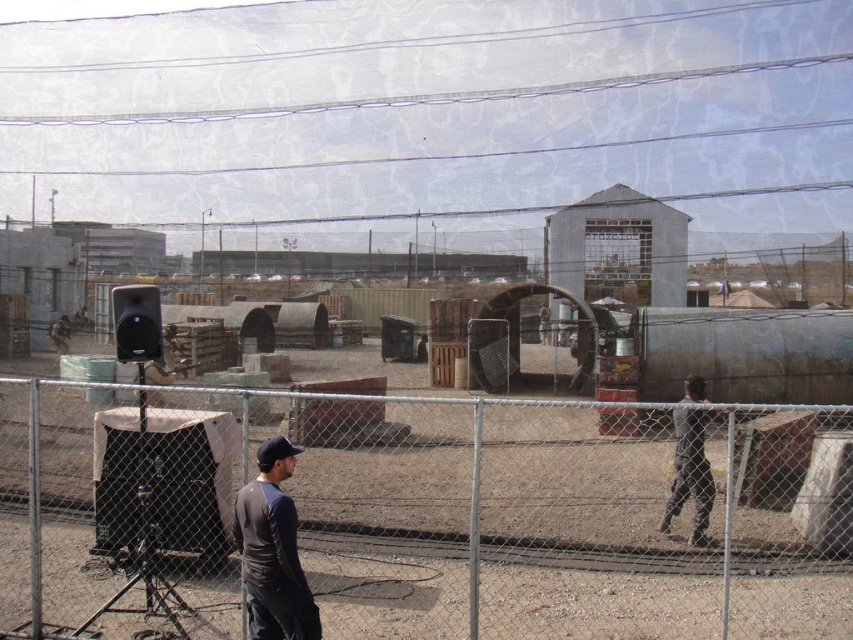
This screenshot has width=853, height=640. I want to click on dark gray cotton shirt at center, so (273, 550).

Who is lower down, dark gray cotton shirt at center or dark gray fabric jacket at right?

dark gray fabric jacket at right is below.

The image size is (853, 640). Identify the location of dark gray cotton shirt at center. (273, 550).

Locate an element on the screen. The image size is (853, 640). dark gray cotton shirt at center is located at coordinates (273, 550).

Does point (131, 452) come in front of point (688, 456)?

That is True.

Does metal chain-link fence at center have a smaller size compared to dark gray fabric jacket at right?

Actually, metal chain-link fence at center might be larger than dark gray fabric jacket at right.

Is point (271, 541) positioned behind point (712, 486)?

No, it is in front of (712, 486).

Identify the location of metal chain-link fence at center. The width and height of the screenshot is (853, 640). (419, 515).

Does metal chain-link fence at center appear on the right side of dark gray cotton shirt at center?

Yes, metal chain-link fence at center is to the right of dark gray cotton shirt at center.

Is point (544, 422) positioned before point (251, 573)?

No, it is behind (251, 573).

The height and width of the screenshot is (640, 853). What are the coordinates of `metal chain-link fence at center` in the screenshot? It's located at (419, 515).